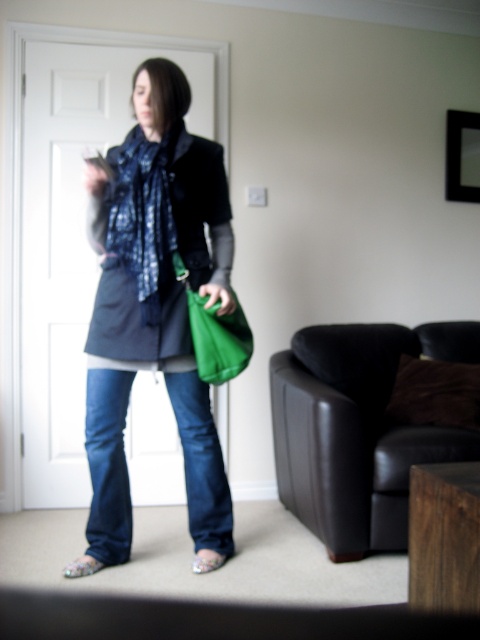
You are a delivery robot trying to navigate through the living room. You need to move from the door on the left to the coffee table in the foreground. There are two points marked in the image, point (365, 538) and point (201, 305). Which point is closer to your current position near the door?

Point (365, 538) is further to the viewer than point (201, 305). Since you are near the door, the closer point would be point (201, 305) because it is nearer to your starting position.

You are a fashion designer observing the person in the image. You need to determine which item takes up more space between the matte black jacket at center and the green leather bag at lower center. Which one is larger?

The matte black jacket at center has a larger size compared to the green leather bag at lower center, so the matte black jacket at center takes up more space.